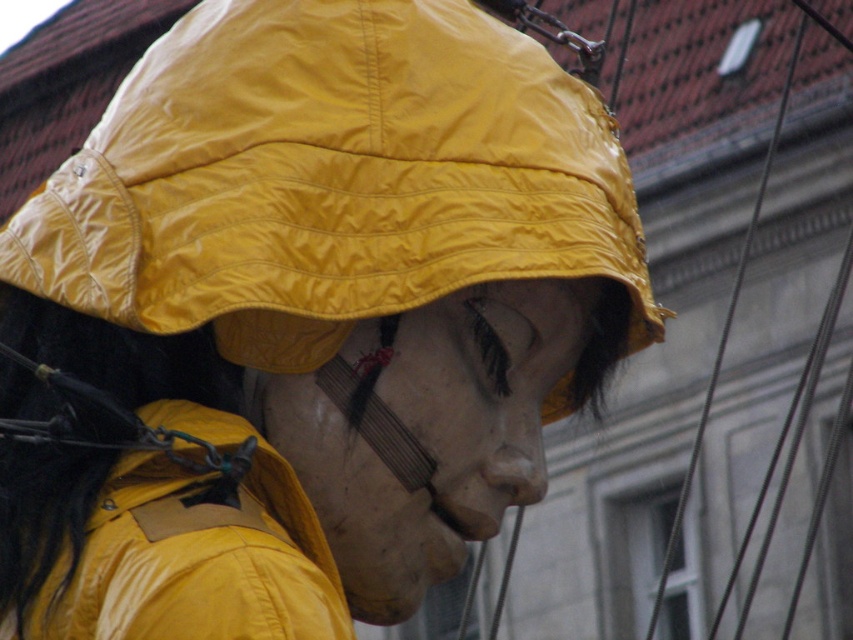
Does yellow matte hat at center have a larger size compared to matte white mask at center?

Yes, yellow matte hat at center is bigger than matte white mask at center.

Looking at this image, is yellow matte hat at center thinner than matte white mask at center?

Incorrect, yellow matte hat at center's width is not less than matte white mask at center's.

I want to click on yellow matte hat at center, so [329, 177].

Consider the image. Who is shorter, matte white mask at center or matte yellow jacket at lower left?

matte yellow jacket at lower left

Between point (375, 397) and point (251, 616), which one is positioned behind?

The point (375, 397) is behind.

What do you see at coordinates (428, 432) in the screenshot? I see `matte white mask at center` at bounding box center [428, 432].

Image resolution: width=853 pixels, height=640 pixels. Identify the location of matte white mask at center. (428, 432).

Who is positioned more to the left, yellow matte hat at center or matte yellow jacket at lower left?

matte yellow jacket at lower left is more to the left.

Is point (137, 268) more distant than point (149, 529)?

Yes.

Between point (340, 156) and point (289, 588), which one is positioned in front?

Point (289, 588)

The height and width of the screenshot is (640, 853). What are the coordinates of `yellow matte hat at center` in the screenshot? It's located at (329, 177).